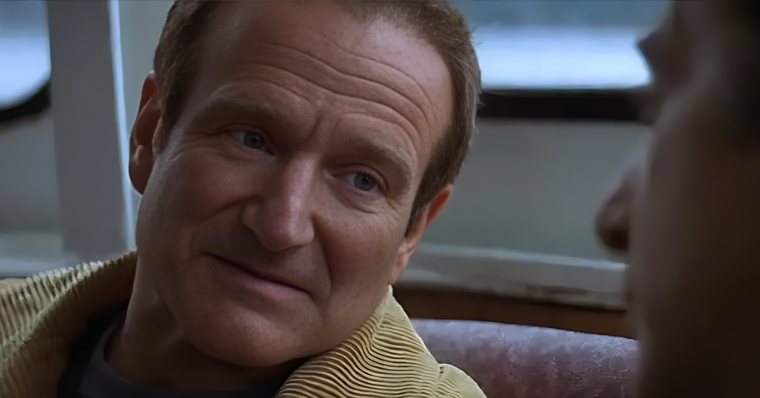
Find the location of a particular element. The image size is (760, 398). window is located at coordinates (543, 43), (23, 40).